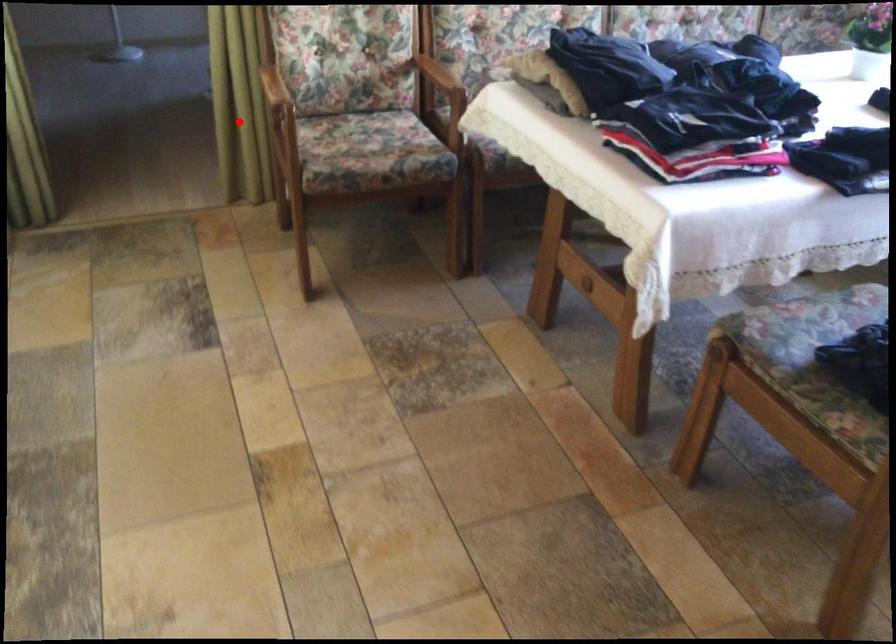
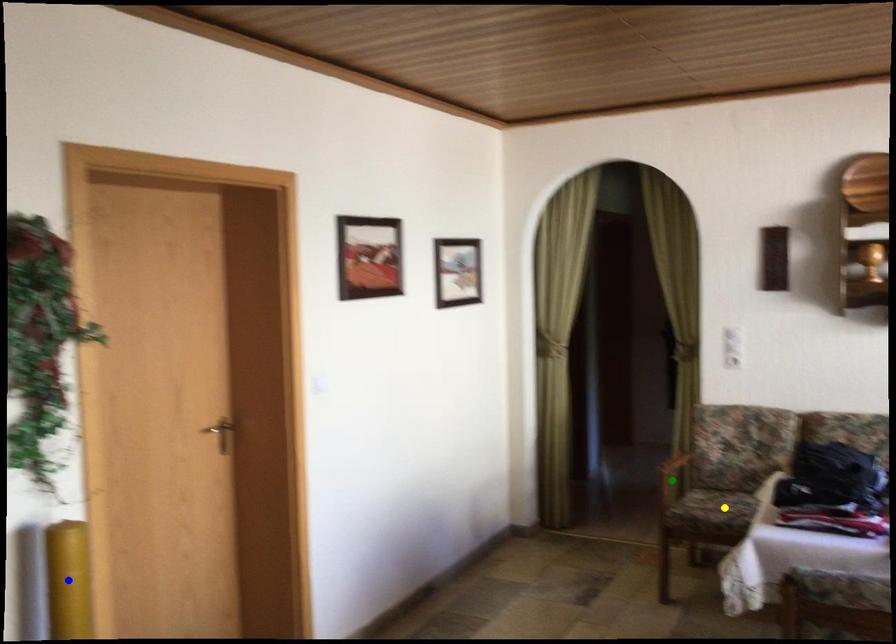
Question: I am providing you with two images of the same scene from different viewpoints. A red point is marked on the first image. You are given multiple points on the second image. In image 2, which mark is for the same physical point as the one in image 1?

Choices:
 (A) green point
 (B) yellow point
 (C) blue point

Answer: (A)